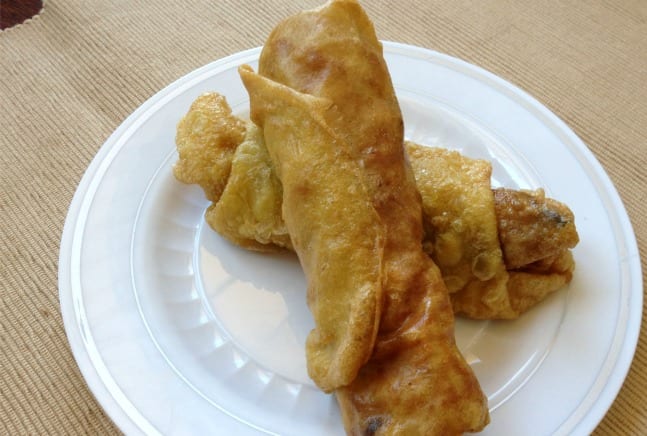
I want to click on edge of plate, so click(61, 315), click(619, 225).